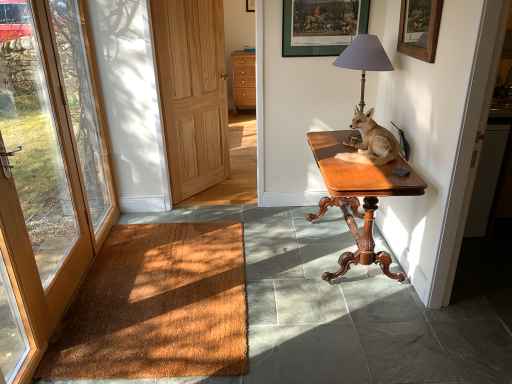
I want to click on unoccupied area in front of mahogany wood desk at right, so click(x=355, y=330).